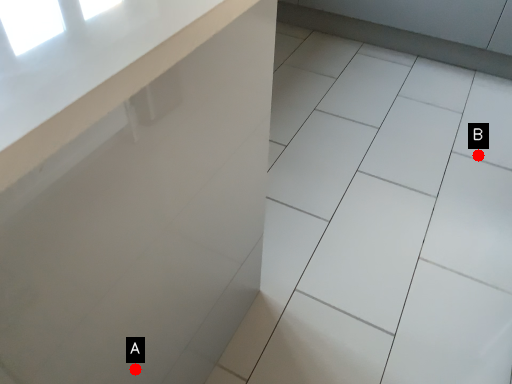
Question: Two points are circled on the image, labeled by A and B beside each circle. Which of the following is the closest to the observer?

Choices:
 (A) A is closer
 (B) B is closer

Answer: (A)